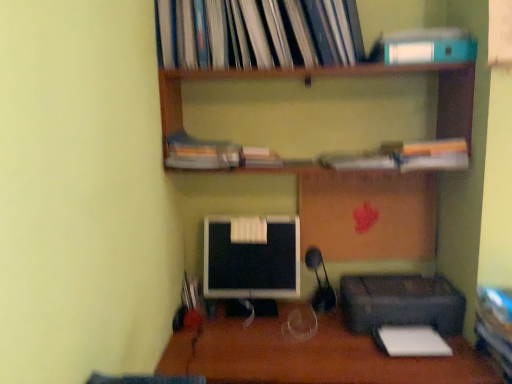
Locate an element on the screen. vacant area located to the right-hand side of white paper at lower right is located at coordinates (468, 353).